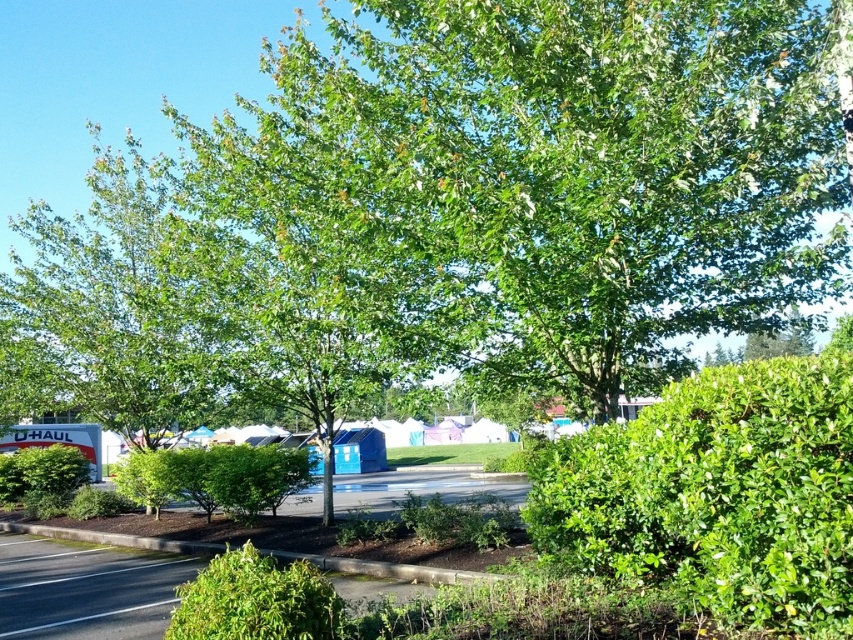
Does green leafy hedge at center right appear on the left side of green leafy bush at lower left?

No, green leafy hedge at center right is not to the left of green leafy bush at lower left.

This screenshot has width=853, height=640. What do you see at coordinates (717, 493) in the screenshot?
I see `green leafy hedge at center right` at bounding box center [717, 493].

Is point (750, 531) farther from camera compared to point (10, 470)?

No, it is in front of (10, 470).

At what (x,y) coordinates should I click in order to perform the action: click on green leafy hedge at center right. Please return your answer as a coordinate pair (x, y). Image resolution: width=853 pixels, height=640 pixels. Looking at the image, I should click on (717, 493).

Which of these two, green leafy hedge at center right or green leafy bush at center, stands shorter?

Standing shorter between the two is green leafy bush at center.

Who is more forward, [796,529] or [254,456]?

Point [796,529] is more forward.

At what (x,y) coordinates should I click in order to perform the action: click on green leafy hedge at center right. Please return your answer as a coordinate pair (x, y). Looking at the image, I should click on point(717,493).

Does green leafy bush at center have a smaller size compared to brown concrete curb at lower center?

Yes, green leafy bush at center is smaller than brown concrete curb at lower center.

Between green leafy bush at center and brown concrete curb at lower center, which one has less height?

green leafy bush at center

Between point (239, 515) and point (438, 572), which one is positioned in front?

Point (438, 572)

Locate an element on the screen. green leafy bush at center is located at coordinates (253, 476).